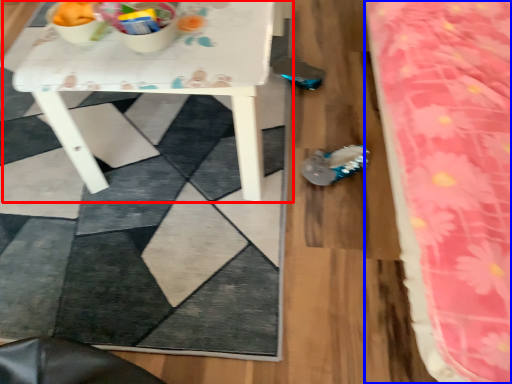
Question: Which point is closer to the camera, table (highlighted by a red box) or bed (highlighted by a blue box)?

Choices:
 (A) table
 (B) bed

Answer: (B)